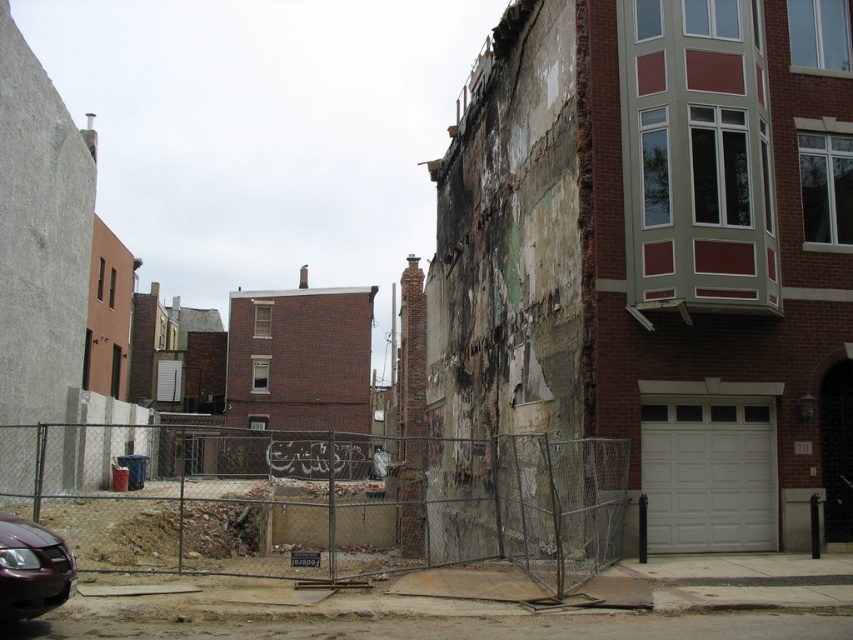
Question: Is metallic chain-link fence at center smaller than shiny maroon car at lower left?

Choices:
 (A) yes
 (B) no

Answer: (B)

Question: Can you confirm if metallic chain-link fence at center is positioned to the left of shiny maroon car at lower left?

Choices:
 (A) no
 (B) yes

Answer: (B)

Question: Does metallic chain-link fence at center appear on the right side of shiny maroon car at lower left?

Choices:
 (A) yes
 (B) no

Answer: (B)

Question: Which object appears farthest from the camera in this image?

Choices:
 (A) shiny maroon car at lower left
 (B) metallic chain-link fence at center

Answer: (B)

Question: Among these points, which one is nearest to the camera?

Choices:
 (A) (265, 541)
 (B) (39, 586)

Answer: (B)